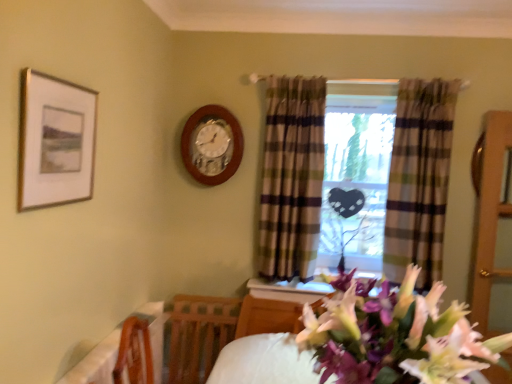
You are a GUI agent. You are given a task and a screenshot of the screen. Output one action in this format:
    pyautogui.click(x=<x>, y=<y>)
    Task: Click on the wooden wall clock at center
    This screenshot has height=384, width=512.
    Given the screenshot: What is the action you would take?
    pyautogui.click(x=212, y=145)

Consider the image. Measure the distance between pink silky flowers at center and camera.

pink silky flowers at center and camera are 32.97 inches apart from each other.

What is the approximate width of pink silky flowers at center?

pink silky flowers at center is 50.89 centimeters in width.

Locate an element on the screen. This screenshot has height=384, width=512. plaid fabric window at center is located at coordinates (419, 178).

What is the approximate width of plaid fabric window at center?

plaid fabric window at center is 11.43 inches wide.

Describe the element at coordinates (291, 177) in the screenshot. I see `plaid fabric curtain at center, arranged as the 1th curtain when viewed from the left` at that location.

At what (x,y) coordinates should I click in order to perform the action: click on wooden wall clock at center. Please return your answer as a coordinate pair (x, y). Looking at the image, I should click on (212, 145).

Which point is more distant from viewer, (155, 363) or (485, 298)?

The point (485, 298) is farther.

From a real-world perspective, who is located lower, wooden table at lower left or clear glass door at right?

wooden table at lower left is physically lower.

Is wooden table at lower left completely or partially outside of clear glass door at right?

Yes, wooden table at lower left is outside of clear glass door at right.

What's the angular difference between wooden table at lower left and clear glass door at right's facing directions?

There is a 90.6-degree angle between the facing directions of wooden table at lower left and clear glass door at right.

Is gold-framed picture at upper left in contact with clear glass door at right?

They are not placed beside each other.

Is gold-framed picture at upper left oriented towards clear glass door at right?

Yes, gold-framed picture at upper left is aimed at clear glass door at right.

Is point (59, 142) positioned behind point (510, 126)?

That is False.

The height and width of the screenshot is (384, 512). I want to click on table on the left of plaid fabric curtain at center, the second curtain viewed from the left, so click(x=96, y=363).

Is plaid fabric curtain at center, which is the first curtain in right-to-left order, to the left of wooden table at lower left from the viewer's perspective?

Incorrect, plaid fabric curtain at center, which is the first curtain in right-to-left order, is not on the left side of wooden table at lower left.

Does plaid fabric curtain at center, the second curtain viewed from the left, have a greater width compared to wooden table at lower left?

Yes, plaid fabric curtain at center, the second curtain viewed from the left, is wider than wooden table at lower left.

Is gold-framed picture at upper left oriented towards wooden table at lower left?

No.

Is gold-framed picture at upper left situated inside wooden table at lower left or outside?

gold-framed picture at upper left is outside wooden table at lower left.

Where is `table on the right side of gold-framed picture at upper left`? This screenshot has width=512, height=384. table on the right side of gold-framed picture at upper left is located at coordinates (96, 363).

Which object is wider, gold-framed picture at upper left or wooden table at lower left?

With larger width is wooden table at lower left.

Between wooden wall clock at center and plaid fabric curtain at center, the second curtain viewed from the left, which one is positioned in front?

plaid fabric curtain at center, the second curtain viewed from the left.

Is point (189, 160) positioned before point (417, 106)?

No, it is not.

Is wooden wall clock at center touching plaid fabric curtain at center, which is the first curtain in right-to-left order?

There is a gap between wooden wall clock at center and plaid fabric curtain at center, which is the first curtain in right-to-left order.

Who is shorter, wooden wall clock at center or plaid fabric curtain at center, the second curtain viewed from the left?

wooden wall clock at center.

Considering the relative sizes of wooden table at lower left and pink silky flowers at center in the image provided, is wooden table at lower left taller than pink silky flowers at center?

No, wooden table at lower left is not taller than pink silky flowers at center.

Is wooden table at lower left further to camera compared to pink silky flowers at center?

Yes.

Which is more distant, (113, 337) or (448, 358)?

The point (113, 337) is farther.

From a real-world perspective, is wooden table at lower left over pink silky flowers at center?

No, from a real-world perspective, wooden table at lower left is not above pink silky flowers at center.

Between plaid fabric curtain at center, the second curtain from the right, and clear glass door at right, which one appears on the right side from the viewer's perspective?

From the viewer's perspective, clear glass door at right appears more on the right side.

In the scene shown: Is the position of plaid fabric curtain at center, the second curtain from the right, less distant than that of clear glass door at right?

No.

Considering the points (272, 188) and (508, 111), which point is in front, point (272, 188) or point (508, 111)?

Point (508, 111)

Is plaid fabric curtain at center, the second curtain from the right, completely or partially outside of clear glass door at right?

Indeed, plaid fabric curtain at center, the second curtain from the right, is completely outside clear glass door at right.

Where is `glass door above the wooden table at lower left (from a real-world perspective)`? This screenshot has width=512, height=384. glass door above the wooden table at lower left (from a real-world perspective) is located at coordinates (489, 210).

Where is `glass door located underneath the gold-framed picture at upper left (from a real-world perspective)`? This screenshot has height=384, width=512. glass door located underneath the gold-framed picture at upper left (from a real-world perspective) is located at coordinates (489, 210).

When comparing their distances from gold-framed picture at upper left, does pink silky flowers at center or plaid fabric curtain at center, the second curtain viewed from the left, seem further?

plaid fabric curtain at center, the second curtain viewed from the left, lies further to gold-framed picture at upper left than the other object.

Looking at the image, which one is located further to plaid fabric curtain at center, the second curtain viewed from the left, wooden table at lower left or plaid fabric window at center?

Based on the image, wooden table at lower left appears to be further to plaid fabric curtain at center, the second curtain viewed from the left.

From the image, which object appears to be nearer to plaid fabric curtain at center, the second curtain from the right, wooden table at lower left or plaid fabric window at center?

plaid fabric window at center is closer to plaid fabric curtain at center, the second curtain from the right.

Considering their positions, is wooden wall clock at center positioned closer to plaid fabric curtain at center, the second curtain from the right, than wooden table at lower left?

wooden wall clock at center.

From the image, which object appears to be nearer to gold-framed picture at upper left, clear glass door at right or plaid fabric curtain at center, the second curtain viewed from the left?

plaid fabric curtain at center, the second curtain viewed from the left, lies closer to gold-framed picture at upper left than the other object.

Consider the image. Which object lies further to the anchor point pink silky flowers at center, wooden wall clock at center or wooden table at lower left?

Based on the image, wooden wall clock at center appears to be further to pink silky flowers at center.

Estimate the real-world distances between objects in this image. Which object is closer to pink silky flowers at center, gold-framed picture at upper left or wooden wall clock at center?

gold-framed picture at upper left lies closer to pink silky flowers at center than the other object.

Estimate the real-world distances between objects in this image. Which object is closer to wooden wall clock at center, gold-framed picture at upper left or plaid fabric curtain at center, which is the first curtain in right-to-left order?

gold-framed picture at upper left.

Identify the location of window located between wooden wall clock at center and clear glass door at right in the left-right direction. 419,178.

At what (x,y) coordinates should I click in order to perform the action: click on glass door between pink silky flowers at center and plaid fabric curtain at center, which is the first curtain in right-to-left order, from front to back. Please return your answer as a coordinate pair (x, y). Looking at the image, I should click on (489, 210).

Locate an element on the screen. table between pink silky flowers at center and plaid fabric curtain at center, the second curtain from the right, in the front-back direction is located at coordinates (96, 363).

At what (x,y) coordinates should I click in order to perform the action: click on wall clock located between gold-framed picture at upper left and plaid fabric window at center in the depth direction. Please return your answer as a coordinate pair (x, y). This screenshot has height=384, width=512. Looking at the image, I should click on (212, 145).